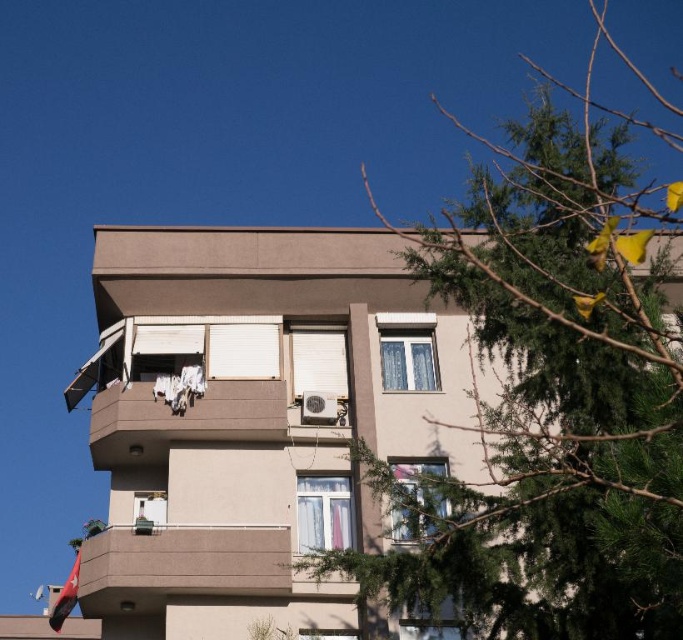
You are a window cleaner standing in front of the building. You have a ladder that can reach up to 2 meters. The white sheer curtain at center is at a height of 1.8 meters, and the clear glass window at lower right is at 1.5 meters. Can you clean both windows without needing a taller ladder?

The white sheer curtain at center is at 1.8 meters and the clear glass window at lower right is at 1.5 meters. Since your ladder can reach up to 2 meters, you can clean both windows without needing a taller ladder because both are within the ladder height limit.

You are standing in front of the residential building and want to locate the white sheer curtain at center. According to the coordinate system where the bottom left corner of the image is the origin, can you determine its location?

The white sheer curtain at center is located at coordinates point (322,513).

You are standing in front of the residential building and notice a point marked at coordinates (180, 564). What does this point indicate?

The point at coordinates 0.885, 0.265 corresponds to the smooth concrete balcony at lower center.